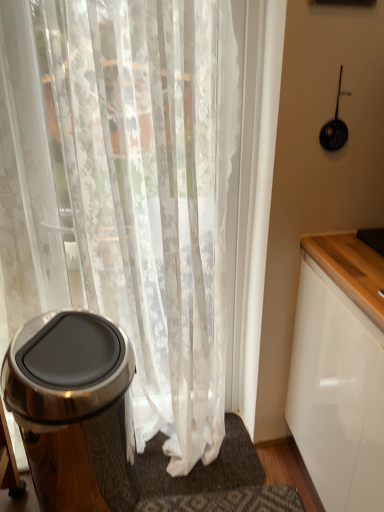
Question: Considering the relative sizes of polished stainless steel trash can at left and white textured bath mat at lower center in the image provided, is polished stainless steel trash can at left wider than white textured bath mat at lower center?

Choices:
 (A) yes
 (B) no

Answer: (A)

Question: Is polished stainless steel trash can at left at the right side of white textured bath mat at lower center?

Choices:
 (A) yes
 (B) no

Answer: (B)

Question: From the image's perspective, is polished stainless steel trash can at left over white textured bath mat at lower center?

Choices:
 (A) yes
 (B) no

Answer: (A)

Question: Considering the relative sizes of polished stainless steel trash can at left and white textured bath mat at lower center in the image provided, is polished stainless steel trash can at left shorter than white textured bath mat at lower center?

Choices:
 (A) no
 (B) yes

Answer: (A)

Question: Considering the relative sizes of polished stainless steel trash can at left and white textured bath mat at lower center in the image provided, is polished stainless steel trash can at left thinner than white textured bath mat at lower center?

Choices:
 (A) no
 (B) yes

Answer: (A)

Question: Is polished stainless steel trash can at left positioned behind white textured bath mat at lower center?

Choices:
 (A) no
 (B) yes

Answer: (A)

Question: From a real-world perspective, is polished stainless steel trash can at left over white sheer curtain at left?

Choices:
 (A) yes
 (B) no

Answer: (B)

Question: Is white sheer curtain at left a part of polished stainless steel trash can at left?

Choices:
 (A) yes
 (B) no

Answer: (B)

Question: Are polished stainless steel trash can at left and white sheer curtain at left located far from each other?

Choices:
 (A) no
 (B) yes

Answer: (A)

Question: Is polished stainless steel trash can at left taller than white sheer curtain at left?

Choices:
 (A) yes
 (B) no

Answer: (B)

Question: Does polished stainless steel trash can at left have a larger size compared to white sheer curtain at left?

Choices:
 (A) yes
 (B) no

Answer: (B)

Question: Can we say polished stainless steel trash can at left lies outside white sheer curtain at left?

Choices:
 (A) no
 (B) yes

Answer: (A)

Question: Can you confirm if white sheer curtain at left is wider than polished stainless steel trash can at left?

Choices:
 (A) yes
 (B) no

Answer: (B)